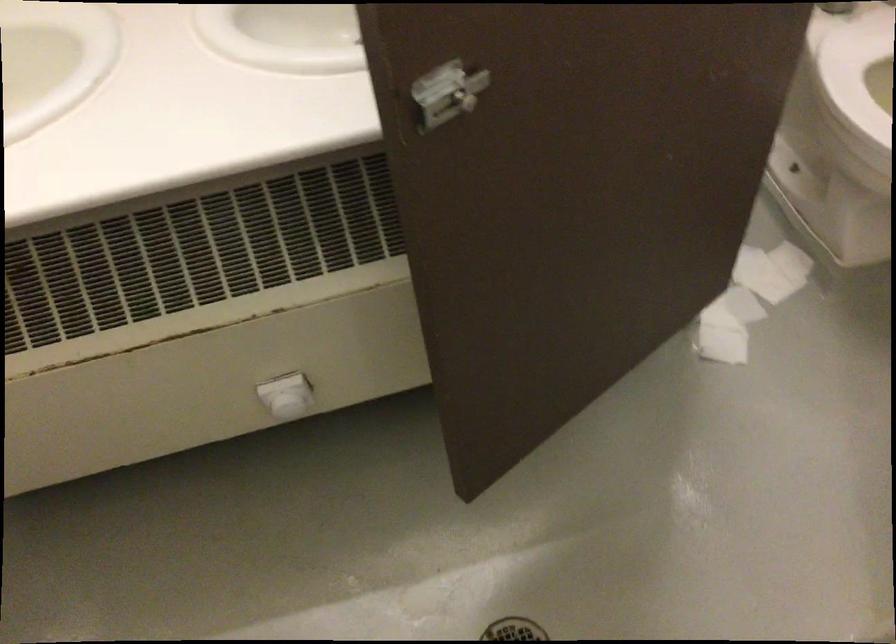
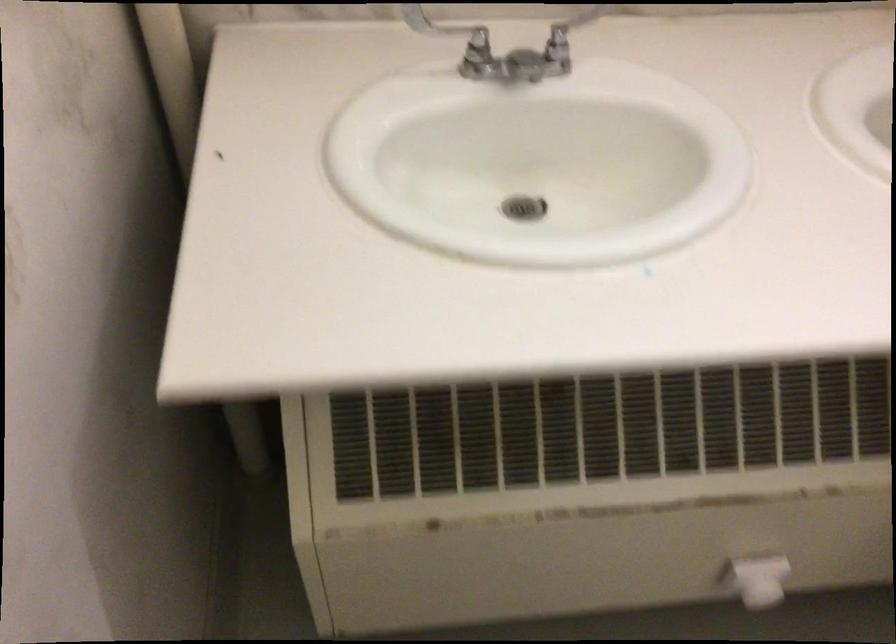
Locate, in the second image, the point that corresponds to (x=289, y=400) in the first image.

(759, 580)